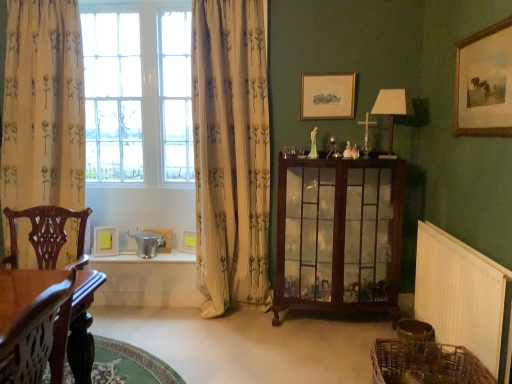
Locate an element on the screen. The height and width of the screenshot is (384, 512). vacant area that lies between mahogany glass cabinet at center and white floral fabric curtain at left, positioned as the 2th curtain in left-to-right order is located at coordinates (245, 326).